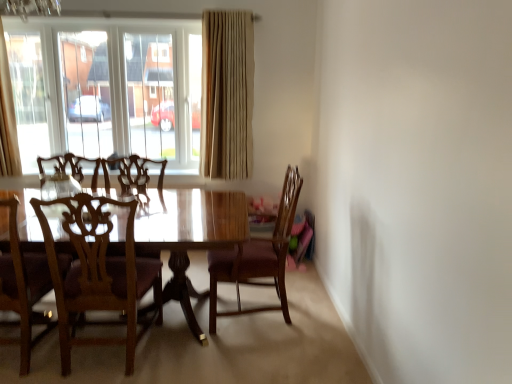
At what (x,y) coordinates should I click in order to perform the action: click on beige fabric curtain at upper center, positioned as the 2th curtain in left-to-right order. Please return your answer as a coordinate pair (x, y). The height and width of the screenshot is (384, 512). Looking at the image, I should click on (227, 94).

This screenshot has width=512, height=384. Find the location of `wooden chair at left, placed as the 2th chair when sorted from left to right`. wooden chair at left, placed as the 2th chair when sorted from left to right is located at coordinates (97, 270).

In order to face wooden chair at left, which is the 2th chair from right to left, should I rotate leftwards or rightwards?

A 19.327 degree turn to the left will do.

At what (x,y) coordinates should I click in order to perform the action: click on wooden chair at left, arranged as the 3th chair when viewed from the right. Please return your answer as a coordinate pair (x, y). The image size is (512, 384). Looking at the image, I should click on (23, 288).

Measure the distance between point (26, 287) and camera.

The distance of point (26, 287) from camera is 7.97 feet.

Identify the location of transparent glass window at upper left. (106, 89).

Identify the location of wooden chair at center, which ranks as the third chair in left-to-right order. The image size is (512, 384). (258, 257).

Is beige fabric curtain at upper center, positioned as the 2th curtain in left-to-right order, at the left side of wooden chair at left, which is the 2th chair from right to left?

No.

From the image's perspective, is beige fabric curtain at upper center, positioned as the 2th curtain in left-to-right order, on wooden chair at left, which is the 2th chair from right to left?

Yes, from the image's perspective, beige fabric curtain at upper center, positioned as the 2th curtain in left-to-right order, is over wooden chair at left, which is the 2th chair from right to left.

Which is in front, point (233, 73) or point (84, 278)?

The point (84, 278) is closer.

Is beige fabric curtain at upper center, arranged as the first curtain when viewed from the right, next to wooden chair at left, placed as the 2th chair when sorted from left to right, and touching it?

They are not placed beside each other.

Does transparent glass window at upper left turn towards wooden chair at left, which is the 2th chair from right to left?

Yes, transparent glass window at upper left is oriented towards wooden chair at left, which is the 2th chair from right to left.

Does transparent glass window at upper left appear on the right side of wooden chair at left, which is the 2th chair from right to left?

No, transparent glass window at upper left is not to the right of wooden chair at left, which is the 2th chair from right to left.

Consider the image. How different are the orientations of transparent glass window at upper left and wooden chair at left, which is the 2th chair from right to left, in degrees?

They differ by 178 degrees in their facing directions.

This screenshot has height=384, width=512. I want to click on the 3rd chair directly beneath the transparent glass window at upper left (from a real-world perspective), so click(x=97, y=270).

From the image's perspective, would you say wooden chair at left, the 1th chair from the left, is shown under transparent glass window at upper left?

Yes.

Which object is further away from the camera, wooden chair at left, arranged as the 3th chair when viewed from the right, or transparent glass window at upper left?

transparent glass window at upper left is further away from the camera.

Identify the location of window above the wooden chair at left, the 1th chair from the left (from a real-world perspective). (106, 89).

Considering the sizes of objects wooden chair at left, arranged as the 3th chair when viewed from the right, and transparent glass window at upper left in the image provided, who is taller, wooden chair at left, arranged as the 3th chair when viewed from the right, or transparent glass window at upper left?

Standing taller between the two is transparent glass window at upper left.

Considering the sizes of wooden chair at left, which is the 2th chair from right to left, and beige fabric curtain at upper left, the first curtain positioned from the left, in the image, is wooden chair at left, which is the 2th chair from right to left, taller or shorter than beige fabric curtain at upper left, the first curtain positioned from the left,?

wooden chair at left, which is the 2th chair from right to left, is shorter than beige fabric curtain at upper left, the first curtain positioned from the left.

The image size is (512, 384). In order to click on the 2nd chair below the beige fabric curtain at upper left, the first curtain positioned from the left (from the image's perspective) in this screenshot , I will do pos(97,270).

Consider the image. From the image's perspective, is wooden chair at left, which is the 2th chair from right to left, positioned above or below beige fabric curtain at upper left, which ranks as the second curtain in right-to-left order?

From the image's perspective, wooden chair at left, which is the 2th chair from right to left, appears below beige fabric curtain at upper left, which ranks as the second curtain in right-to-left order.

Does wooden chair at left, placed as the 2th chair when sorted from left to right, turn towards beige fabric curtain at upper left, which ranks as the second curtain in right-to-left order?

No.

Who is shorter, wooden chair at left, placed as the 2th chair when sorted from left to right, or wooden chair at center, which ranks as the third chair in left-to-right order?

Standing shorter between the two is wooden chair at left, placed as the 2th chair when sorted from left to right.

From the image's perspective, which one is positioned lower, wooden chair at left, which is the 2th chair from right to left, or wooden chair at center, which ranks as the third chair in left-to-right order?

From the image's view, wooden chair at left, which is the 2th chair from right to left, is below.

How much distance is there between wooden chair at left, placed as the 2th chair when sorted from left to right, and wooden chair at center, which appears as the 1th chair when viewed from the right?

wooden chair at left, placed as the 2th chair when sorted from left to right, is 26.13 inches from wooden chair at center, which appears as the 1th chair when viewed from the right.

Does point (48, 217) come in front of point (248, 270)?

Yes, point (48, 217) is in front of point (248, 270).

Looking at this image, considering the relative sizes of wooden chair at center, which appears as the 1th chair when viewed from the right, and beige fabric curtain at upper left, the first curtain positioned from the left, in the image provided, is wooden chair at center, which appears as the 1th chair when viewed from the right, wider than beige fabric curtain at upper left, the first curtain positioned from the left,?

Indeed, wooden chair at center, which appears as the 1th chair when viewed from the right, has a greater width compared to beige fabric curtain at upper left, the first curtain positioned from the left.

From a real-world perspective, who is located lower, wooden chair at center, which ranks as the third chair in left-to-right order, or beige fabric curtain at upper left, the first curtain positioned from the left?

In real-world perspective, wooden chair at center, which ranks as the third chair in left-to-right order, is lower.

Considering the positions of objects wooden chair at center, which appears as the 1th chair when viewed from the right, and beige fabric curtain at upper left, which ranks as the second curtain in right-to-left order, in the image provided, who is more to the right, wooden chair at center, which appears as the 1th chair when viewed from the right, or beige fabric curtain at upper left, which ranks as the second curtain in right-to-left order,?

Positioned to the right is wooden chair at center, which appears as the 1th chair when viewed from the right.

In terms of size, does transparent glass window at upper left appear bigger or smaller than wooden chair at center, which appears as the 1th chair when viewed from the right?

In the image, transparent glass window at upper left appears to be larger than wooden chair at center, which appears as the 1th chair when viewed from the right.

From the image's perspective, is transparent glass window at upper left located above or below wooden chair at center, which appears as the 1th chair when viewed from the right?

transparent glass window at upper left is situated higher than wooden chair at center, which appears as the 1th chair when viewed from the right, in the image.

Does transparent glass window at upper left have a greater width compared to wooden chair at center, which ranks as the third chair in left-to-right order?

Incorrect, the width of transparent glass window at upper left does not surpass that of wooden chair at center, which ranks as the third chair in left-to-right order.

Is transparent glass window at upper left looking in the opposite direction of wooden chair at center, which appears as the 1th chair when viewed from the right?

No, transparent glass window at upper left's orientation is not away from wooden chair at center, which appears as the 1th chair when viewed from the right.

This screenshot has width=512, height=384. Find the location of `the 3rd chair positioned below the beige fabric curtain at upper center, positioned as the 2th curtain in left-to-right order (from a real-world perspective)`. the 3rd chair positioned below the beige fabric curtain at upper center, positioned as the 2th curtain in left-to-right order (from a real-world perspective) is located at coordinates (97, 270).

The width and height of the screenshot is (512, 384). Identify the location of window on the left side of wooden chair at left, placed as the 2th chair when sorted from left to right. (106, 89).

Consider the image. Estimate the real-world distances between objects in this image. Which object is further from transparent glass window at upper left, wooden chair at left, placed as the 2th chair when sorted from left to right, or beige fabric curtain at upper center, positioned as the 2th curtain in left-to-right order?

The object further to transparent glass window at upper left is wooden chair at left, placed as the 2th chair when sorted from left to right.

From the image, which object appears to be nearer to wooden chair at center, which ranks as the third chair in left-to-right order, wooden chair at left, arranged as the 3th chair when viewed from the right, or transparent glass window at upper left?

wooden chair at left, arranged as the 3th chair when viewed from the right.

Looking at the image, which one is located closer to wooden chair at left, which is the 2th chair from right to left, beige fabric curtain at upper left, the first curtain positioned from the left, or wooden chair at left, arranged as the 3th chair when viewed from the right?

Among the two, wooden chair at left, arranged as the 3th chair when viewed from the right, is located nearer to wooden chair at left, which is the 2th chair from right to left.

From the image, which object appears to be farther from wooden chair at left, the 1th chair from the left, wooden chair at left, which is the 2th chair from right to left, or wooden chair at center, which appears as the 1th chair when viewed from the right?

Among the two, wooden chair at center, which appears as the 1th chair when viewed from the right, is located further to wooden chair at left, the 1th chair from the left.

Looking at the image, which one is located further to beige fabric curtain at upper left, which ranks as the second curtain in right-to-left order, wooden chair at left, placed as the 2th chair when sorted from left to right, or wooden chair at left, arranged as the 3th chair when viewed from the right?

The object further to beige fabric curtain at upper left, which ranks as the second curtain in right-to-left order, is wooden chair at left, placed as the 2th chair when sorted from left to right.

Estimate the real-world distances between objects in this image. Which object is closer to beige fabric curtain at upper center, arranged as the first curtain when viewed from the right, wooden chair at left, which is the 2th chair from right to left, or transparent glass window at upper left?

transparent glass window at upper left is closer to beige fabric curtain at upper center, arranged as the first curtain when viewed from the right.

Based on their spatial positions, is wooden chair at left, which is the 2th chair from right to left, or wooden chair at center, which ranks as the third chair in left-to-right order, closer to beige fabric curtain at upper center, positioned as the 2th curtain in left-to-right order?

The object closer to beige fabric curtain at upper center, positioned as the 2th curtain in left-to-right order, is wooden chair at center, which ranks as the third chair in left-to-right order.

Estimate the real-world distances between objects in this image. Which object is closer to wooden chair at left, the 1th chair from the left, beige fabric curtain at upper center, positioned as the 2th curtain in left-to-right order, or beige fabric curtain at upper left, the first curtain positioned from the left?

Based on the image, beige fabric curtain at upper left, the first curtain positioned from the left, appears to be nearer to wooden chair at left, the 1th chair from the left.

Where is `chair located between wooden chair at left, arranged as the 3th chair when viewed from the right, and wooden chair at center, which appears as the 1th chair when viewed from the right, in the left-right direction`? The width and height of the screenshot is (512, 384). chair located between wooden chair at left, arranged as the 3th chair when viewed from the right, and wooden chair at center, which appears as the 1th chair when viewed from the right, in the left-right direction is located at coordinates (97, 270).

Locate an element on the screen. The height and width of the screenshot is (384, 512). chair located between wooden chair at left, which is the 2th chair from right to left, and transparent glass window at upper left in the depth direction is located at coordinates (258, 257).

The width and height of the screenshot is (512, 384). I want to click on curtain situated between beige fabric curtain at upper left, which ranks as the second curtain in right-to-left order, and wooden chair at center, which ranks as the third chair in left-to-right order, from left to right, so click(x=227, y=94).

Locate an element on the screen. Image resolution: width=512 pixels, height=384 pixels. curtain between transparent glass window at upper left and wooden chair at center, which appears as the 1th chair when viewed from the right, in the horizontal direction is located at coordinates (227, 94).